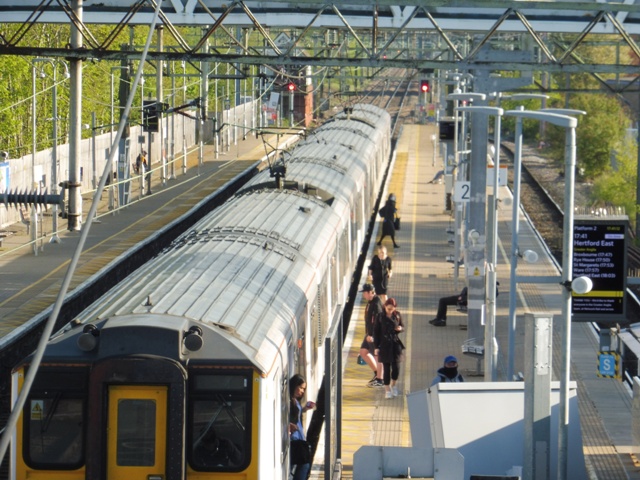
This screenshot has height=480, width=640. I want to click on door, so click(141, 436), click(285, 394).